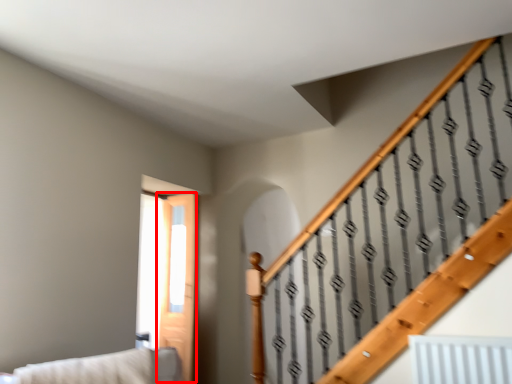
Question: In this image, where is screen door (annotated by the red box) located relative to couch?

Choices:
 (A) right
 (B) left

Answer: (A)